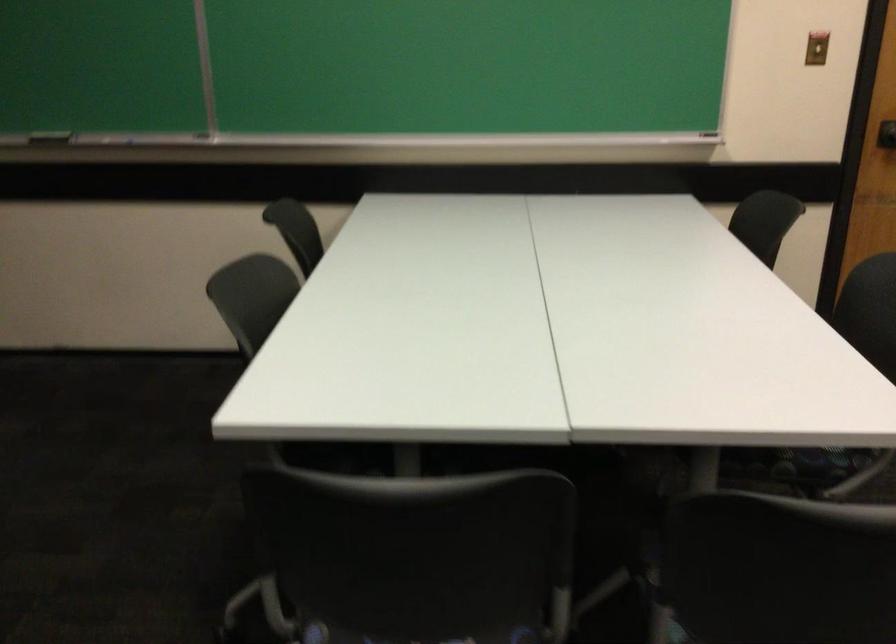
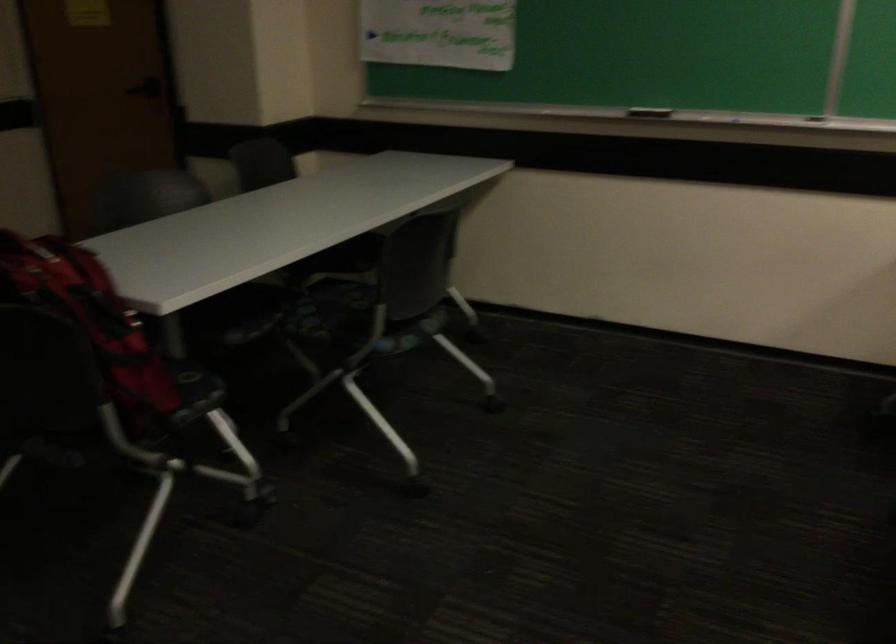
Question: How did the camera likely rotate?

Choices:
 (A) Left
 (B) Right
 (C) Up
 (D) Down

Answer: (A)